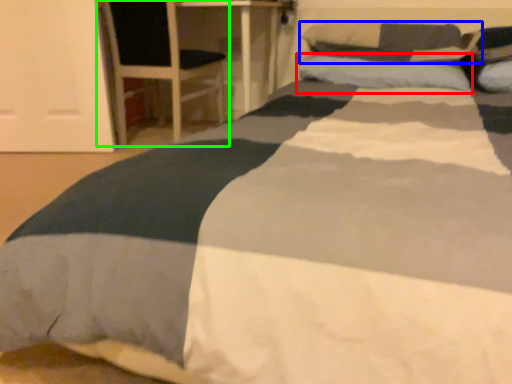
Question: Considering the real-world distances, which object is farthest from pillow (highlighted by a red box)? pillow (highlighted by a blue box) or armchair (highlighted by a green box)?

Choices:
 (A) pillow
 (B) armchair

Answer: (B)